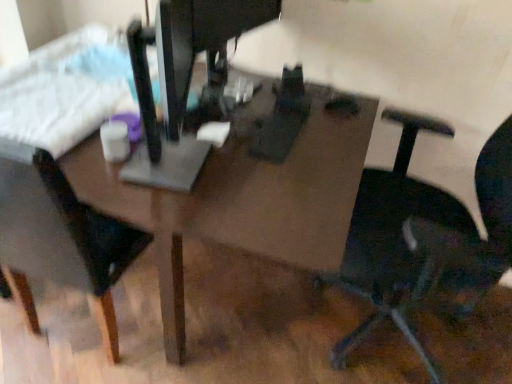
Question: Looking at their shapes, would you say black matte chair at left, the first chair viewed from the left, is wider or thinner than matte brown table at center?

Choices:
 (A) thin
 (B) wide

Answer: (A)

Question: Considering the relative positions of black matte chair at left, marked as the 2th chair in a right-to-left arrangement, and matte brown table at center in the image provided, is black matte chair at left, marked as the 2th chair in a right-to-left arrangement, to the left or to the right of matte brown table at center?

Choices:
 (A) left
 (B) right

Answer: (A)

Question: Estimate the real-world distances between objects in this image. Which object is farther from the black plastic chair at right, positioned as the second chair in left-to-right order?

Choices:
 (A) black matte chair at left, marked as the 2th chair in a right-to-left arrangement
 (B) metallic gray sewing machine at center
 (C) white plastic keyboard at upper left
 (D) matte brown table at center

Answer: (C)

Question: Which object is positioned closest to the metallic gray sewing machine at center?

Choices:
 (A) matte brown table at center
 (B) white plastic keyboard at upper left
 (C) black plastic chair at right, which is the 1th chair from right to left
 (D) black matte chair at left, the first chair viewed from the left

Answer: (A)